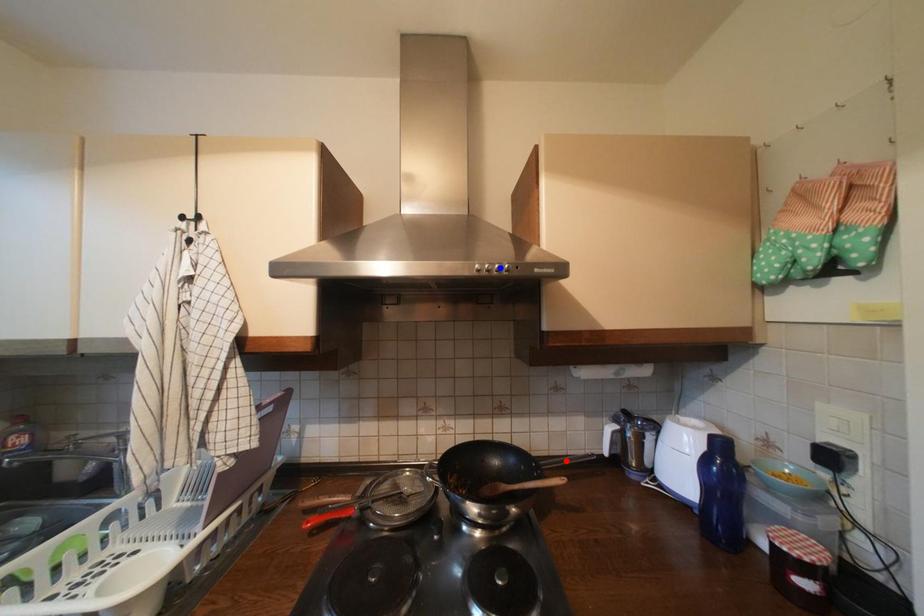
Question: Two points are marked on the image. Which point is closer to the camera?

Choices:
 (A) Blue point is closer.
 (B) Red point is closer.

Answer: (A)